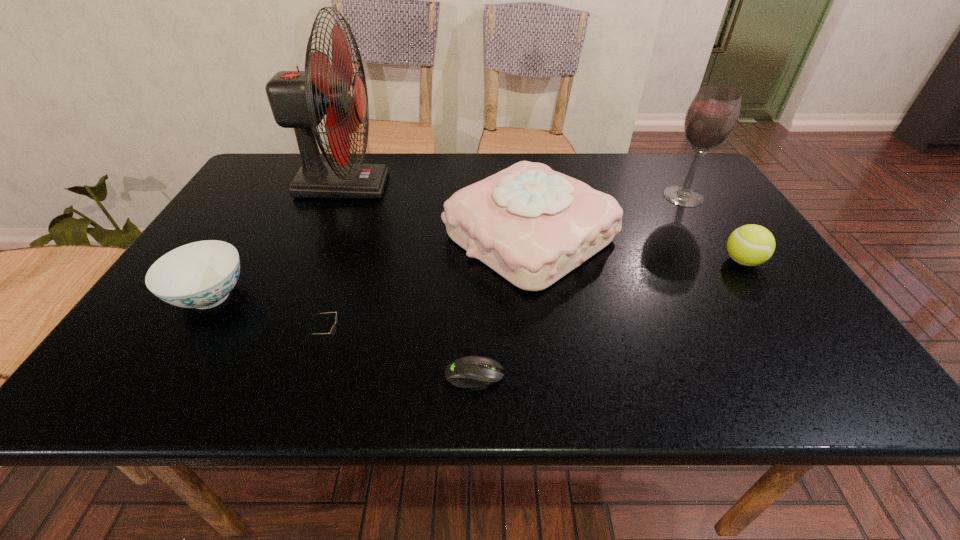
I want to click on chinaware located in the left edge section of the desktop, so click(201, 275).

The image size is (960, 540). In order to click on alcohol situated at the right edge in this screenshot , I will do `click(713, 113)`.

The width and height of the screenshot is (960, 540). In order to click on tennis ball located in the right edge section of the desktop in this screenshot , I will do `click(750, 245)`.

Image resolution: width=960 pixels, height=540 pixels. I want to click on object situated at the far left corner, so click(298, 99).

Identify the location of object that is at the far right corner. (713, 113).

Locate an element on the screen. vacant area at the far edge of the desktop is located at coordinates (492, 166).

Where is `vacant space at the near edge of the desktop`? This screenshot has width=960, height=540. vacant space at the near edge of the desktop is located at coordinates (478, 397).

This screenshot has height=540, width=960. In the image, there is a desktop. What are the coordinates of `free region at the left edge` in the screenshot? It's located at (249, 248).

Find the location of `vacant space at the right edge of the desktop`. vacant space at the right edge of the desktop is located at coordinates (710, 230).

Find the location of `vacant region at the far right corner of the desktop`. vacant region at the far right corner of the desktop is located at coordinates (666, 171).